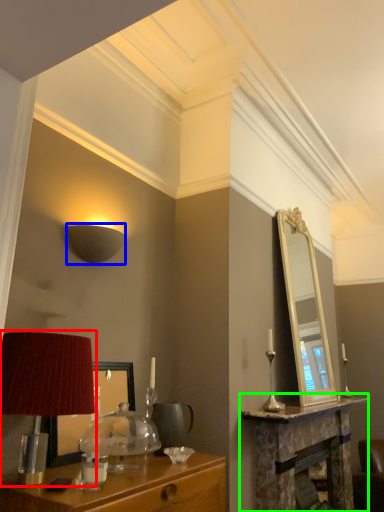
Question: Which object is positioned farthest from table lamp (highlighted by a red box)? Select from lamp (highlighted by a blue box) and table (highlighted by a green box).

Choices:
 (A) lamp
 (B) table

Answer: (B)